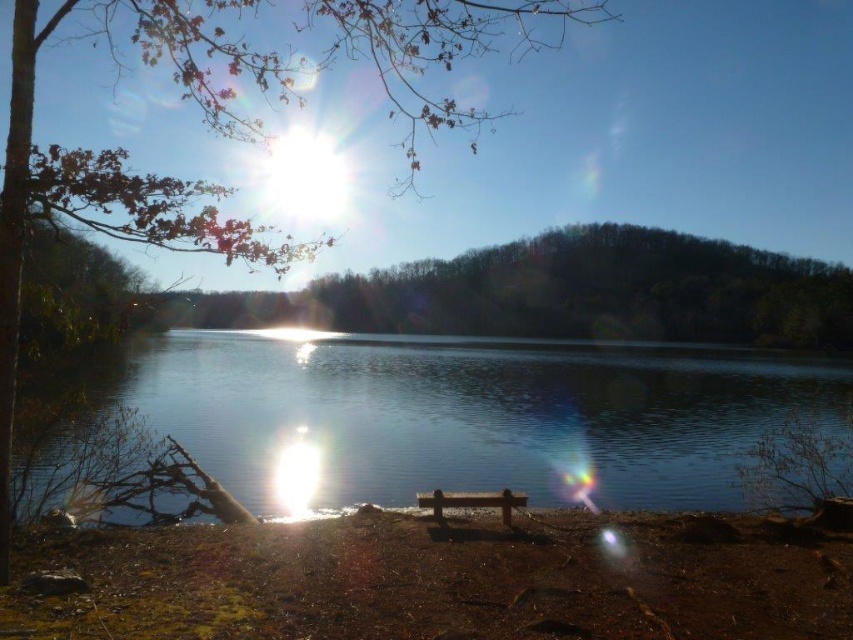
The width and height of the screenshot is (853, 640). What do you see at coordinates (466, 413) in the screenshot? I see `clear water at center` at bounding box center [466, 413].

Measure the distance between clear water at center and camera.

A distance of 10.45 meters exists between clear water at center and camera.

Identify the location of clear water at center. coord(466,413).

Between brown leafy tree at upper left and brown wooden bench at lower center, which one is positioned higher?

brown leafy tree at upper left

Is point (143, 220) positioned in front of point (514, 502)?

That is True.

Image resolution: width=853 pixels, height=640 pixels. What are the coordinates of `brown leafy tree at upper left` in the screenshot? It's located at (126, 164).

Does clear water at center have a lesser height compared to brown dirt at lower center?

Incorrect, clear water at center's height does not fall short of brown dirt at lower center's.

Between clear water at center and brown dirt at lower center, which one has less height?

brown dirt at lower center is shorter.

Does point (657, 465) come closer to viewer compared to point (155, 620)?

No, it is behind (155, 620).

Where is `clear water at center`? This screenshot has width=853, height=640. clear water at center is located at coordinates click(x=466, y=413).